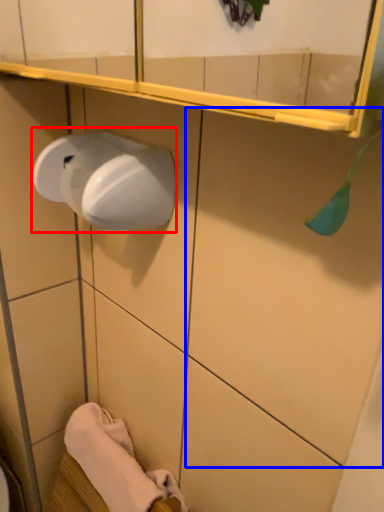
Question: Which object appears farthest to the camera in this image, paper towel (highlighted by a red box) or tile (highlighted by a blue box)?

Choices:
 (A) paper towel
 (B) tile

Answer: (A)